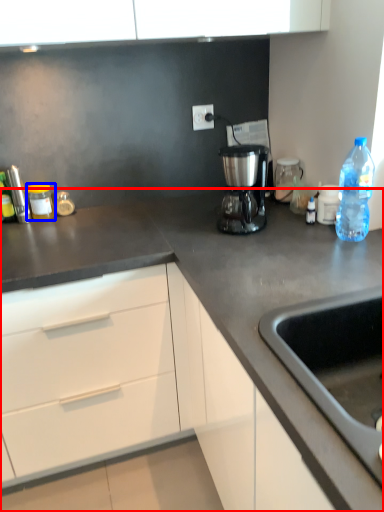
Question: Which point is closer to the camera, countertop (highlighted by a red box) or kitchen appliance (highlighted by a blue box)?

Choices:
 (A) countertop
 (B) kitchen appliance

Answer: (A)